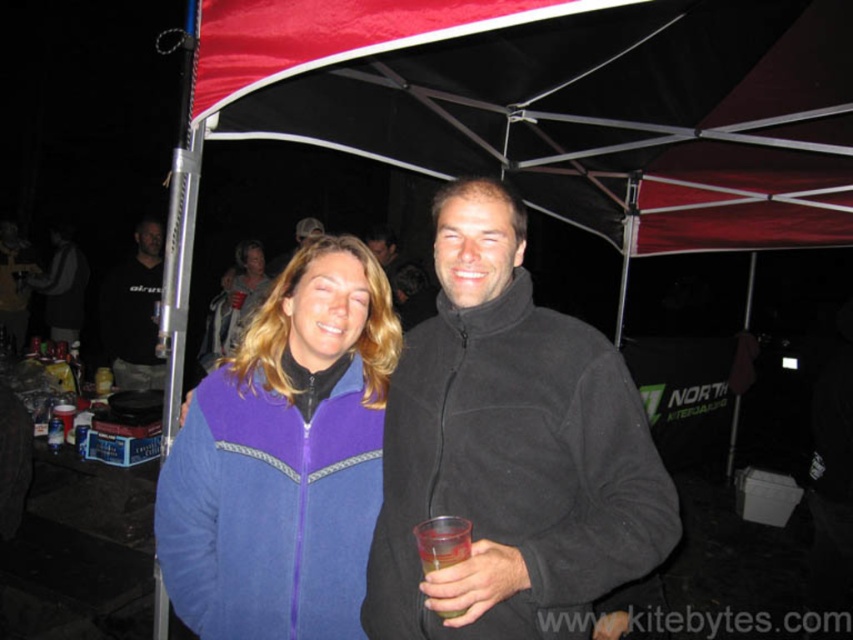
Looking at this image, you are at a party and want to hand a small gift to the person wearing the black fleece jacket at center without spilling the transparent plastic cup at center they are holding. Which object should you avoid placing the gift near?

The transparent plastic cup at center should be avoided because the black fleece jacket at center is much taller than the transparent plastic cup at center, meaning the cup is shorter and likely held at a lower position, so placing the gift near the cup increases the risk of knocking it over.

You are at a party and want to take a photo of both the purple fleece jacket at center and the transparent plastic cup at center. Which object should you focus on first to ensure both are in the frame?

You should focus on the purple fleece jacket at center first because the transparent plastic cup at center is behind it, so positioning the jacket in the foreground ensures the cup will also be visible in the background.